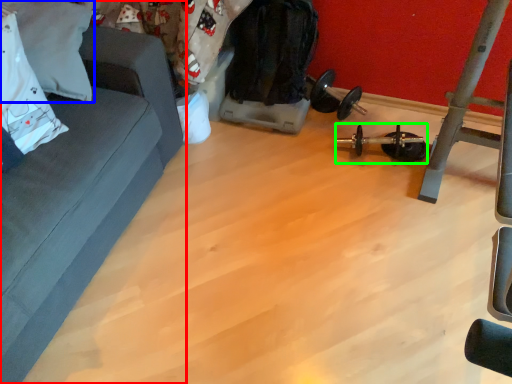
Question: Which object is positioned closest to studio couch (highlighted by a red box)? Select from pillow (highlighted by a blue box) and equipment (highlighted by a green box).

Choices:
 (A) pillow
 (B) equipment

Answer: (A)